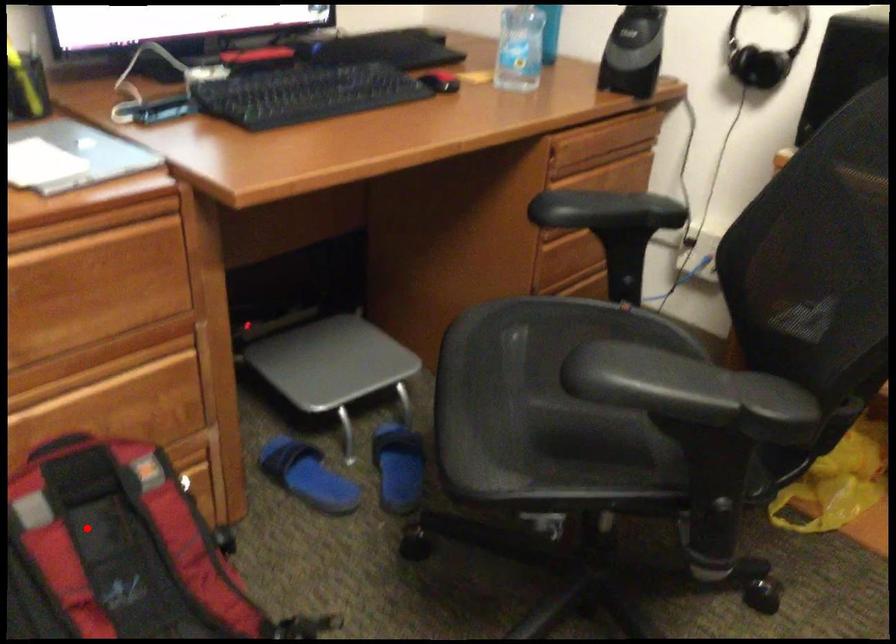
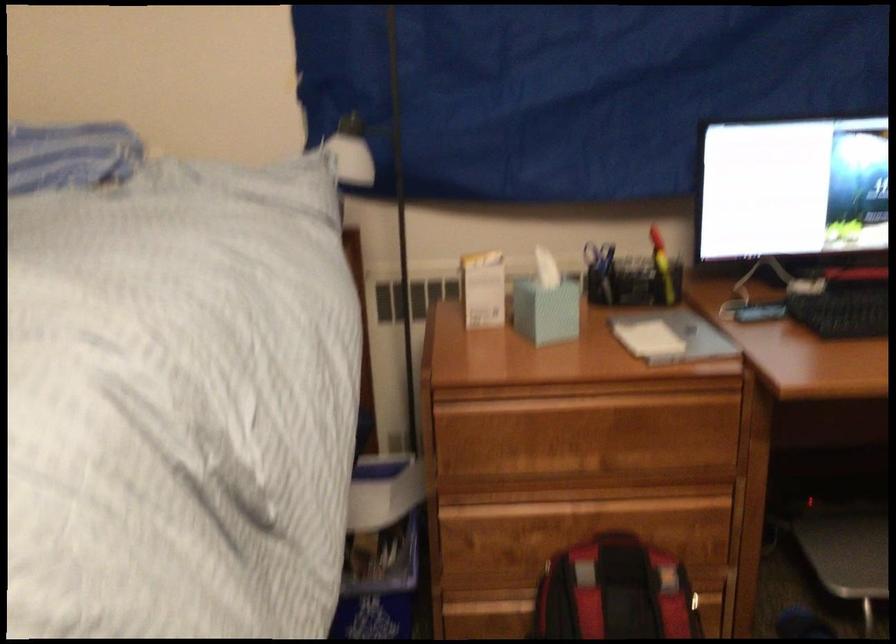
Question: I am providing you with two images of the same scene from different viewpoints. Given a red point in image1, look at the same physical point in image2. Is it:

Choices:
 (A) Closer to the viewpoint
 (B) Farther from the viewpoint

Answer: (B)